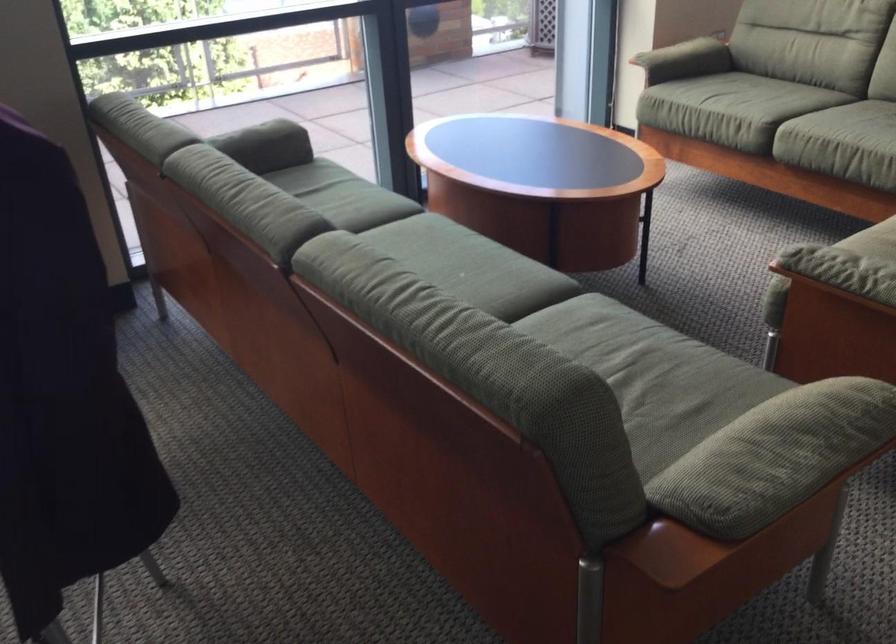
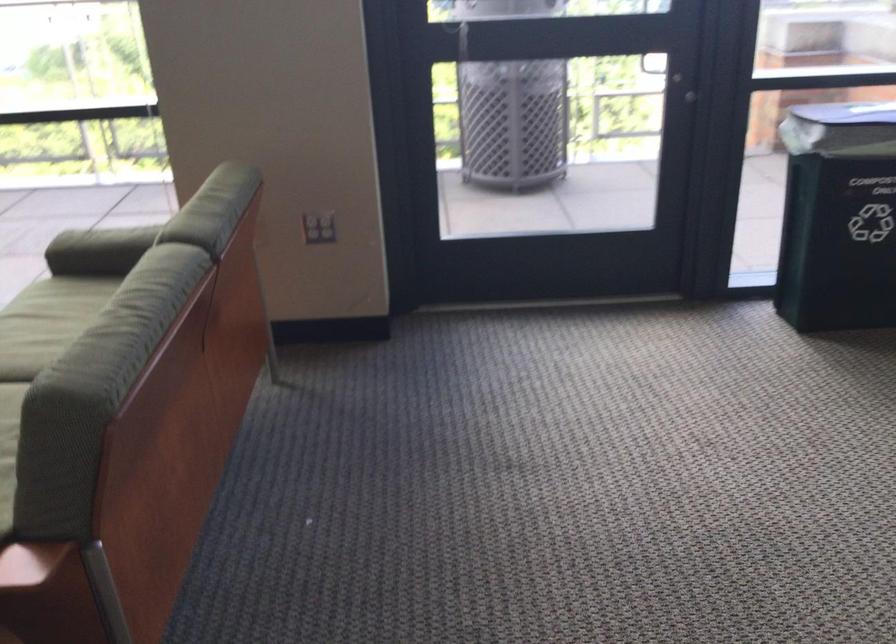
Where in the second image is the point corresponding to [673,67] from the first image?

(99, 247)